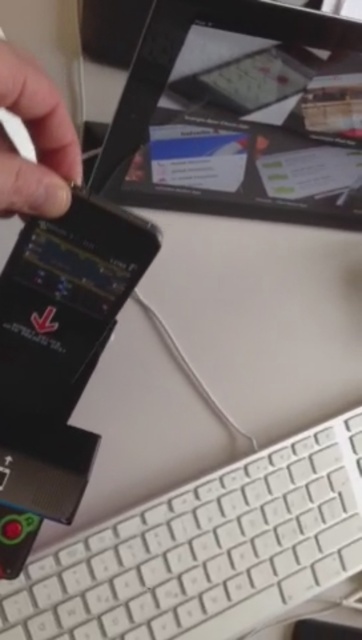
Based on the photo, does black glossy tablet at upper center have a greater height compared to matte black finger at upper left?

Yes.

Locate an element on the screen. The image size is (362, 640). black glossy tablet at upper center is located at coordinates (238, 115).

Is point (69, 618) behind point (30, 77)?

Yes, it is.

Between white plastic keyboard at lower right and matte black finger at upper left, which one is positioned lower?

white plastic keyboard at lower right is below.

Between point (262, 609) and point (77, 177), which one is positioned behind?

Point (262, 609)

Image resolution: width=362 pixels, height=640 pixels. I want to click on white plastic keyboard at lower right, so click(204, 548).

Does black glossy tablet at upper center appear under white plastic keyboard at lower right?

No, black glossy tablet at upper center is not below white plastic keyboard at lower right.

Between black glossy tablet at upper center and white plastic keyboard at lower right, which one appears on the right side from the viewer's perspective?

black glossy tablet at upper center is more to the right.

Measure the distance between point (258, 20) and camera.

The distance of point (258, 20) from camera is 18.81 inches.

At what (x,y) coordinates should I click in order to perform the action: click on black glossy tablet at upper center. Please return your answer as a coordinate pair (x, y). Looking at the image, I should click on (238, 115).